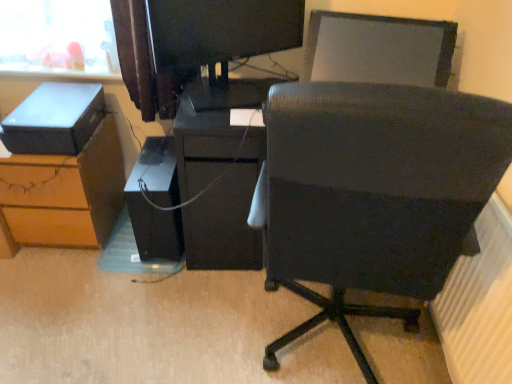
Find the location of a particular element. free spot in front of brown wood desk at lower left is located at coordinates (54, 281).